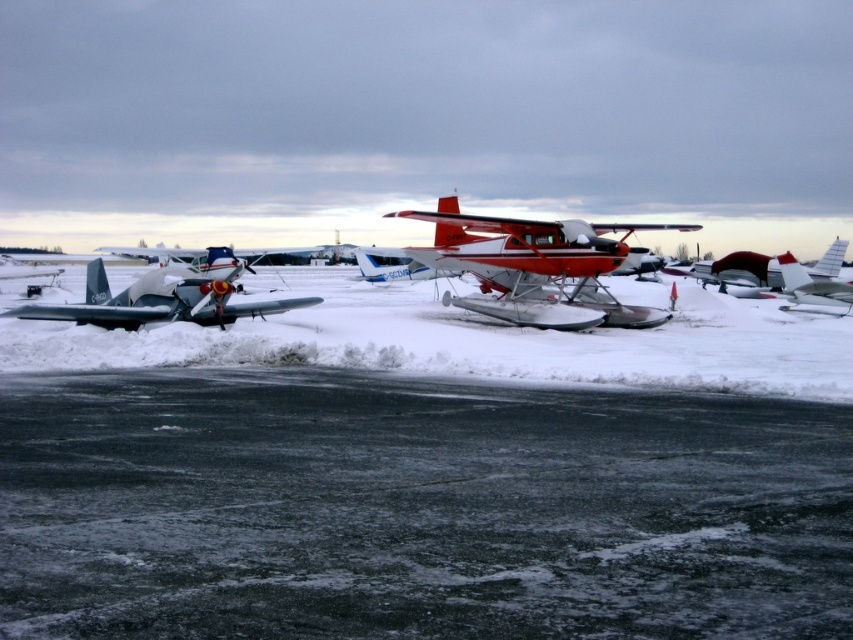
Question: Among these objects, which one is nearest to the camera?

Choices:
 (A) white matte snow at center
 (B) black asphalt tarmac at lower center
 (C) matte black seaplane at center

Answer: (B)

Question: Which of the following is the farthest from the observer?

Choices:
 (A) pyautogui.click(x=260, y=310)
 (B) pyautogui.click(x=73, y=332)
 (C) pyautogui.click(x=447, y=419)
 (D) pyautogui.click(x=566, y=259)

Answer: (D)

Question: Which of these objects is positioned farthest from the black asphalt tarmac at lower center?

Choices:
 (A) silver metallic airplane at left
 (B) red polished aluminum seaplane at center

Answer: (A)

Question: Does silver metallic airplane at left come in front of matte black seaplane at center?

Choices:
 (A) yes
 (B) no

Answer: (A)

Question: Considering the relative positions of black asphalt tarmac at lower center and white matte snow at center in the image provided, where is black asphalt tarmac at lower center located with respect to white matte snow at center?

Choices:
 (A) above
 (B) below

Answer: (B)

Question: Can you confirm if white matte snow at center is positioned to the right of silver metallic airplane at left?

Choices:
 (A) no
 (B) yes

Answer: (B)